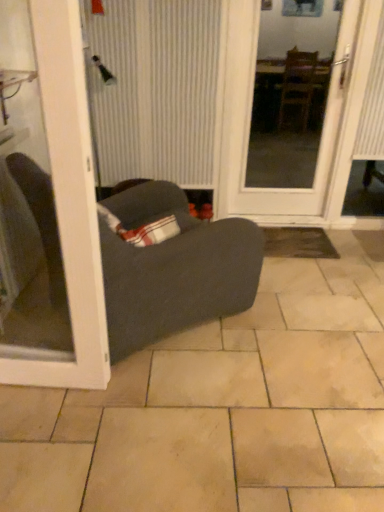
The height and width of the screenshot is (512, 384). Identify the location of vacant area that lies in front of white glossy door at left, which is counted as the second door, starting from the back. (47, 435).